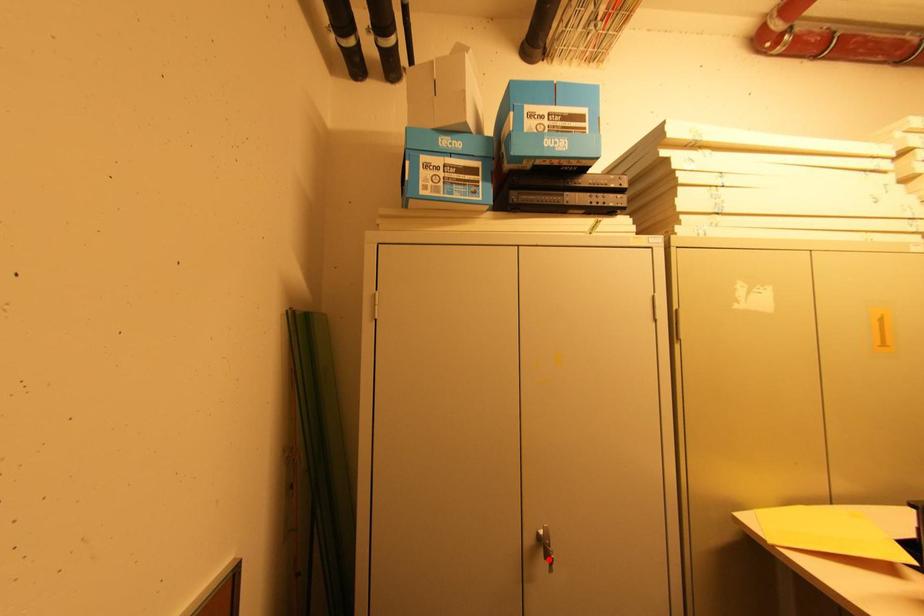
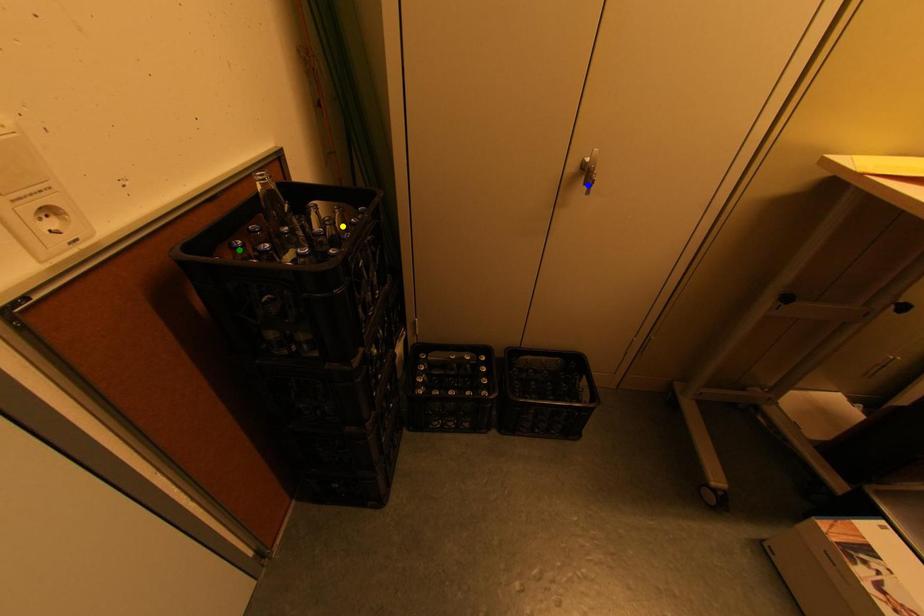
Question: I am providing you with two images of the same scene from different viewpoints. A red point is marked on the first image. You are given multiple points on the second image. Which point in image 2 is actually the same real-world point as the red point in image 1?

Choices:
 (A) blue point
 (B) green point
 (C) yellow point

Answer: (A)